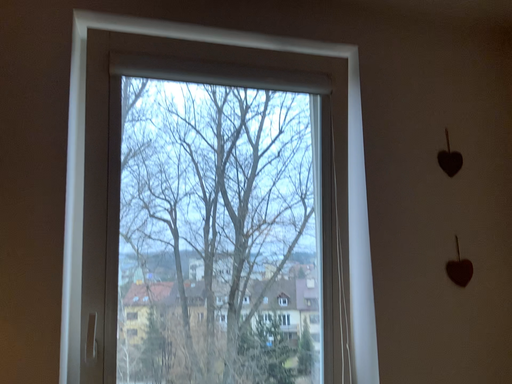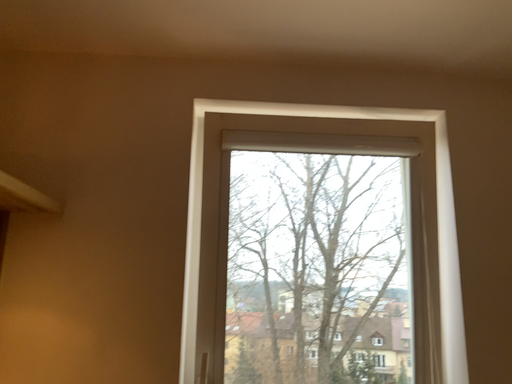
Question: Which way did the camera rotate in the video?

Choices:
 (A) rotated left
 (B) rotated right

Answer: (A)